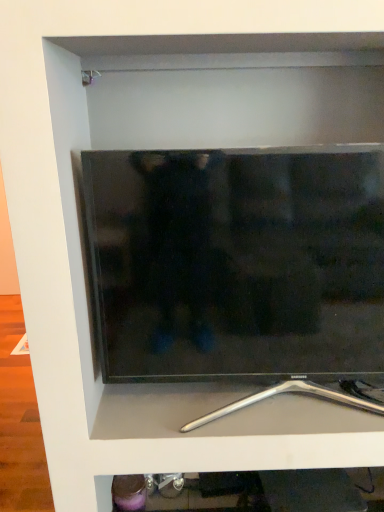
Locate an element on the screen. The image size is (384, 512). vacant space underneath black glossy tv at center (from a real-world perspective) is located at coordinates (246, 413).